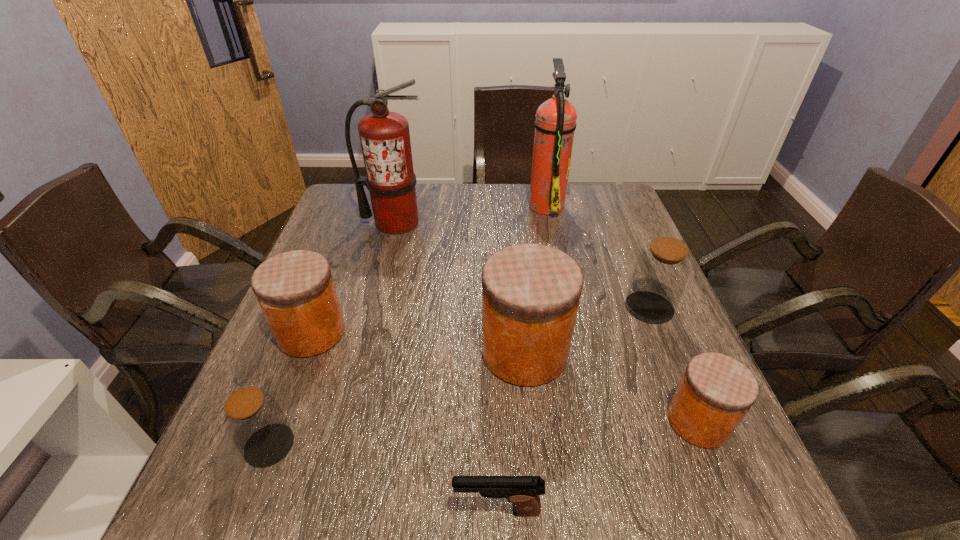
This screenshot has width=960, height=540. In order to click on the right fire extinguisher in this screenshot , I will do `click(555, 124)`.

Find the location of a particular element. The height and width of the screenshot is (540, 960). red fire extinguisher is located at coordinates (385, 138).

You are a GUI agent. You are given a task and a screenshot of the screen. Output one action in this format:
    pyautogui.click(x=<x>, y=<y>)
    Task: Click on the tallest jar
    The width and height of the screenshot is (960, 540).
    Given the screenshot: What is the action you would take?
    pyautogui.click(x=530, y=292)

Find the location of a particular element. This screenshot has width=960, height=540. the third jar from right to left is located at coordinates (530, 292).

At what (x,y) coordinates should I click in order to perform the action: click on the leftmost orange jar. Please return your answer as a coordinate pair (x, y). The image size is (960, 540). Looking at the image, I should click on (295, 290).

Identify the location of the right brown jar. (661, 272).

Where is `the bigger brown jar`? This screenshot has width=960, height=540. the bigger brown jar is located at coordinates (661, 272).

The image size is (960, 540). I want to click on the rightmost orange jar, so click(716, 391).

At what (x,y) coordinates should I click in order to perform the action: click on the nearest orange jar. Please return your answer as a coordinate pair (x, y). This screenshot has width=960, height=540. Looking at the image, I should click on coord(716,391).

You are a GUI agent. You are given a task and a screenshot of the screen. Output one action in this format:
    pyautogui.click(x=<x>, y=<y>)
    Task: Click on the nearer brown jar
    Image resolution: width=960 pixels, height=540 pixels.
    Given the screenshot: What is the action you would take?
    (254, 421)